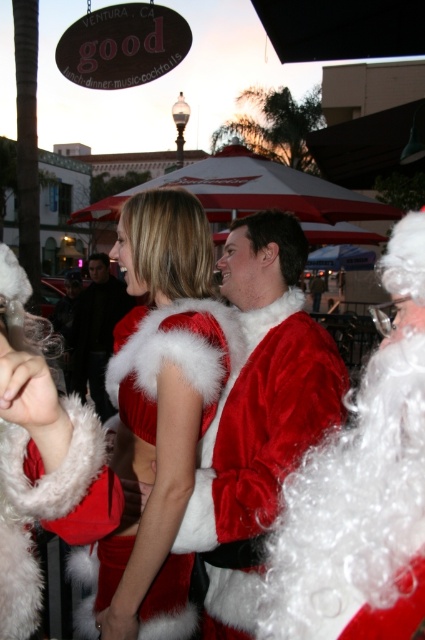
You are a photographer at the event and need to capture a photo where both the velvet santa at right and the velvet red dress at center are visible. Considering their heights, which object should be placed closer to the camera to ensure both are fully visible in the frame?

The velvet santa at right has a lesser height compared to the velvet red dress at center. To ensure both are fully visible, position the velvet red dress at center closer to the camera since its greater height will require more vertical space, while the shorter velvet santa at right can be placed slightly farther back without being cropped out.